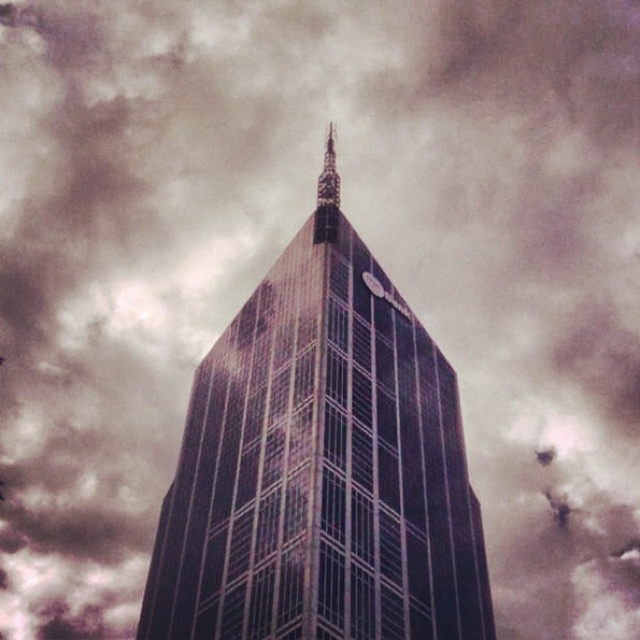
Which of these two, shiny glass tower at center or polished glass spire at center, stands shorter?

shiny glass tower at center is shorter.

Is shiny glass tower at center smaller than polished glass spire at center?

No, shiny glass tower at center is not smaller than polished glass spire at center.

This screenshot has width=640, height=640. Find the location of `shiny glass tower at center`. shiny glass tower at center is located at coordinates (321, 468).